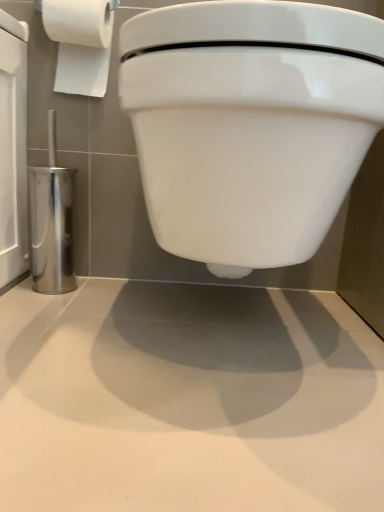
Question: In terms of size, does white paper at upper left appear bigger or smaller than white glossy toilet at center?

Choices:
 (A) big
 (B) small

Answer: (B)

Question: In terms of height, does white paper at upper left look taller or shorter compared to white glossy toilet at center?

Choices:
 (A) tall
 (B) short

Answer: (B)

Question: Which is correct: white paper at upper left is inside white glossy toilet at center, or outside of it?

Choices:
 (A) inside
 (B) outside

Answer: (B)

Question: Do you think white glossy toilet at center is within white paper at upper left, or outside of it?

Choices:
 (A) outside
 (B) inside

Answer: (A)

Question: In the image, is white glossy toilet at center positioned in front of or behind white paper at upper left?

Choices:
 (A) front
 (B) behind

Answer: (A)

Question: From the image's perspective, is white glossy toilet at center located above or below white paper at upper left?

Choices:
 (A) below
 (B) above

Answer: (A)

Question: From their relative heights in the image, would you say white glossy toilet at center is taller or shorter than white paper at upper left?

Choices:
 (A) tall
 (B) short

Answer: (A)